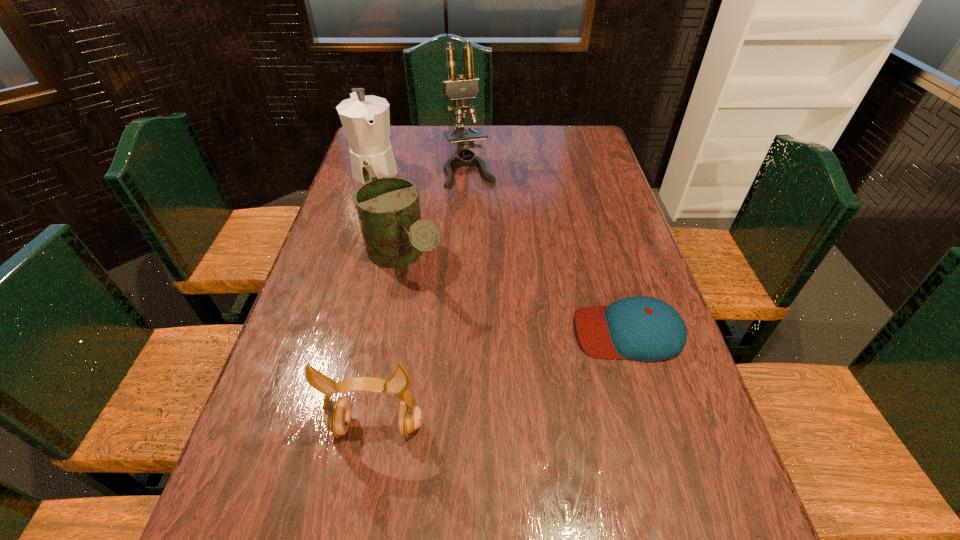
This screenshot has height=540, width=960. I want to click on the nearest object, so click(x=337, y=417).

Find the location of a particular element. This screenshot has width=960, height=540. baseball cap is located at coordinates (643, 328).

The height and width of the screenshot is (540, 960). Identify the location of the rightmost object. (643, 328).

At what (x,y) coordinates should I click in order to perform the action: click on watering can. Please return your answer as a coordinate pair (x, y). The width and height of the screenshot is (960, 540). Looking at the image, I should click on (388, 208).

This screenshot has height=540, width=960. I want to click on the second tallest object, so click(366, 119).

This screenshot has height=540, width=960. Find the location of `microscope`. microscope is located at coordinates (458, 89).

Image resolution: width=960 pixels, height=540 pixels. I want to click on blank area located 0.300m with the bill of the rightmost object facing forward, so point(449,332).

Identify the location of vacant space situated with the bill of the rightmost object facing forward. (529, 332).

Where is `vacant area situated 0.380m with the bill of the rightmost object facing forward`? The width and height of the screenshot is (960, 540). vacant area situated 0.380m with the bill of the rightmost object facing forward is located at coordinates (416, 332).

Where is `vacant space located with the spout on the watering can`? This screenshot has height=540, width=960. vacant space located with the spout on the watering can is located at coordinates (446, 333).